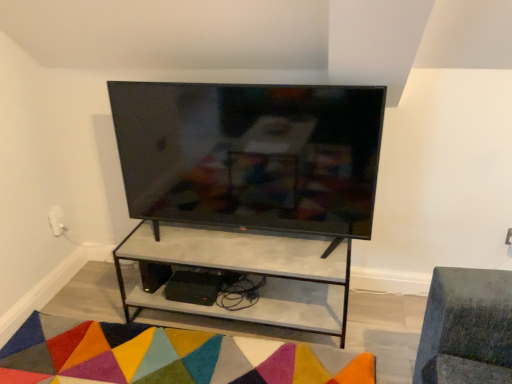
Question: Is matte black tv at center closer to the viewer compared to multicolored felt mat at lower center?

Choices:
 (A) no
 (B) yes

Answer: (A)

Question: Is matte black tv at center shorter than multicolored felt mat at lower center?

Choices:
 (A) no
 (B) yes

Answer: (A)

Question: Is multicolored felt mat at lower center a part of matte black tv at center?

Choices:
 (A) no
 (B) yes

Answer: (A)

Question: From the image's perspective, would you say matte black tv at center is positioned over multicolored felt mat at lower center?

Choices:
 (A) yes
 (B) no

Answer: (A)

Question: From the image's perspective, would you say matte black tv at center is shown under multicolored felt mat at lower center?

Choices:
 (A) no
 (B) yes

Answer: (A)

Question: From a real-world perspective, is matte black tv at center over multicolored felt mat at lower center?

Choices:
 (A) no
 (B) yes

Answer: (B)

Question: Considering the relative positions of matte concrete shelf at center and multicolored felt mat at lower center in the image provided, is matte concrete shelf at center to the right of multicolored felt mat at lower center from the viewer's perspective?

Choices:
 (A) no
 (B) yes

Answer: (B)

Question: Considering the relative sizes of matte concrete shelf at center and multicolored felt mat at lower center in the image provided, is matte concrete shelf at center smaller than multicolored felt mat at lower center?

Choices:
 (A) no
 (B) yes

Answer: (A)

Question: Does matte concrete shelf at center come behind multicolored felt mat at lower center?

Choices:
 (A) no
 (B) yes

Answer: (B)

Question: Can you confirm if matte concrete shelf at center is wider than multicolored felt mat at lower center?

Choices:
 (A) no
 (B) yes

Answer: (B)

Question: Are matte concrete shelf at center and multicolored felt mat at lower center located far from each other?

Choices:
 (A) yes
 (B) no

Answer: (B)

Question: Does matte concrete shelf at center have a lesser height compared to multicolored felt mat at lower center?

Choices:
 (A) yes
 (B) no

Answer: (B)

Question: Is matte black tv at center a part of matte concrete shelf at center?

Choices:
 (A) yes
 (B) no

Answer: (B)